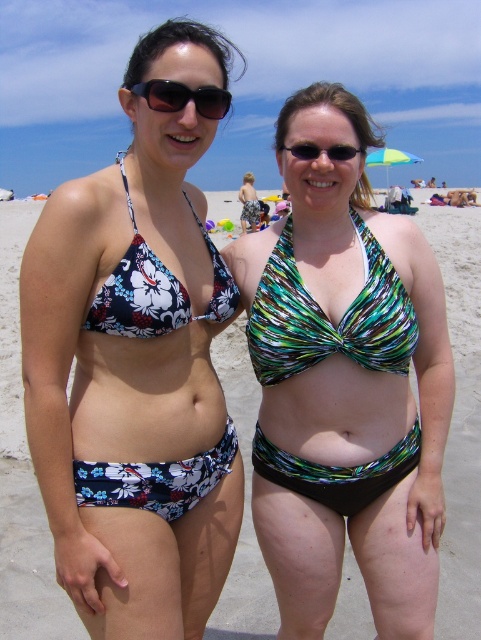
Is multicolored bikini top at center taller than matte black sunglasses at upper center?

Indeed, multicolored bikini top at center has a greater height compared to matte black sunglasses at upper center.

Is multicolored bikini top at center positioned at the back of matte black sunglasses at upper center?

Yes, it is.

Is point (377, 124) less distant than point (164, 109)?

No, it is behind (164, 109).

What are the coordinates of `multicolored bikini top at center` in the screenshot? It's located at (331, 106).

Can you confirm if floral fabric bikini top at center is positioned to the right of floral print bikini top at center?

Incorrect, floral fabric bikini top at center is not on the right side of floral print bikini top at center.

Where is `floral fabric bikini top at center`? The height and width of the screenshot is (640, 481). floral fabric bikini top at center is located at coordinates (134, 362).

Which is behind, point (130, 540) or point (182, 320)?

Point (182, 320)

The width and height of the screenshot is (481, 640). In order to click on floral fabric bikini top at center in this screenshot , I will do `click(134, 362)`.

You are a GUI agent. You are given a task and a screenshot of the screen. Output one action in this format:
    pyautogui.click(x=<x>, y=<y>)
    Task: Click on the floral fabric bikini top at center
    The image size is (481, 640).
    Given the screenshot: What is the action you would take?
    pyautogui.click(x=134, y=362)

Between point (61, 296) and point (147, 253), which one is positioned in front?

Positioned in front is point (61, 296).

Is point (216, 552) less distant than point (165, 492)?

No, (216, 552) is further to viewer.

Find the location of a particular element. floral fabric bikini top at center is located at coordinates (134, 362).